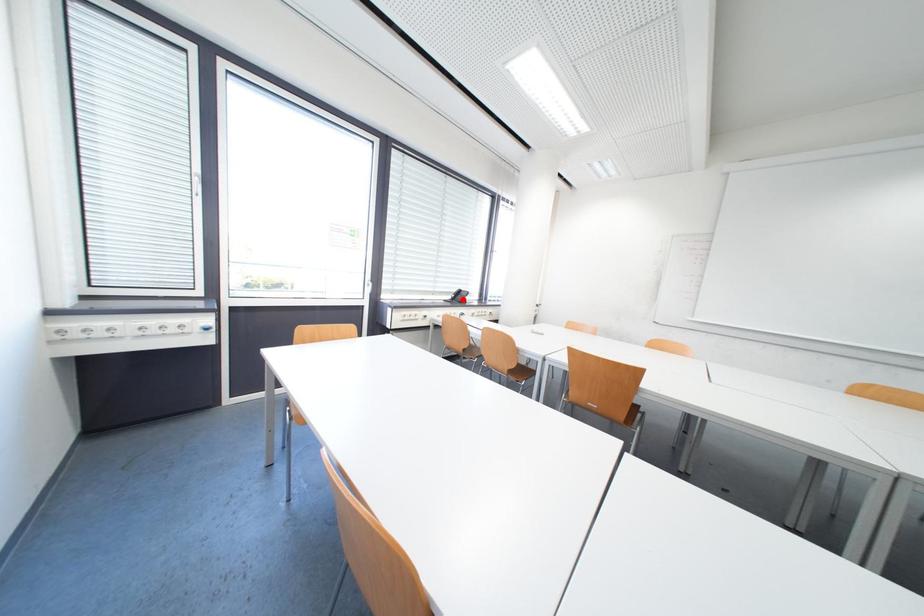
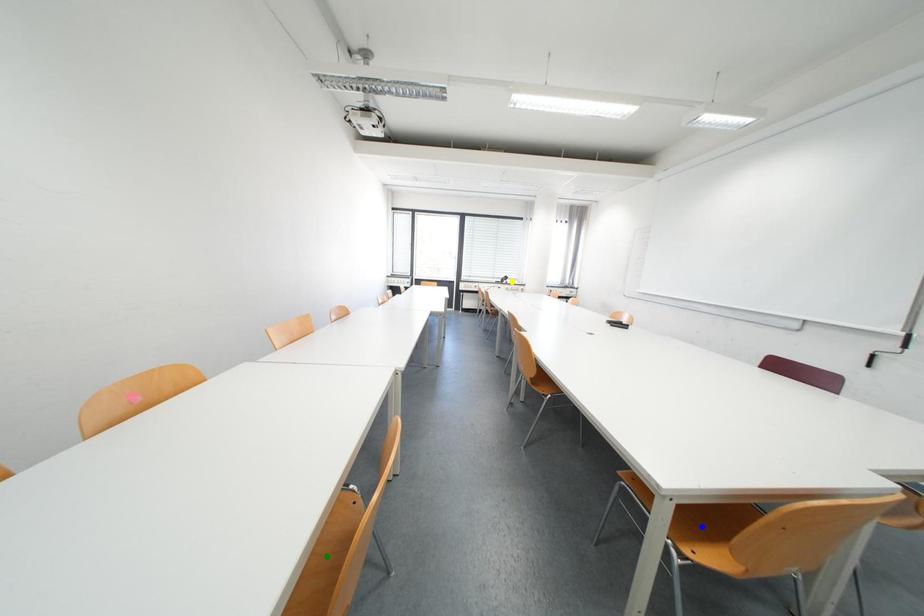
Question: I am providing you with two images of the same scene from different viewpoints. A red point is marked on the first image. You are given multiple points on the second image. In image 2, which mark is for the same physical point as the one in image 1?

Choices:
 (A) blue point
 (B) yellow point
 (C) green point

Answer: (B)